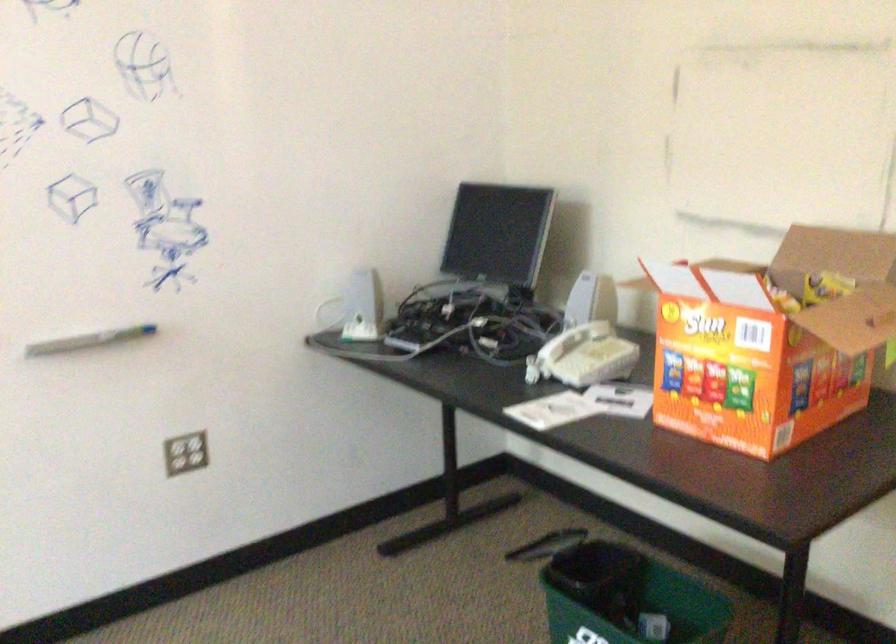
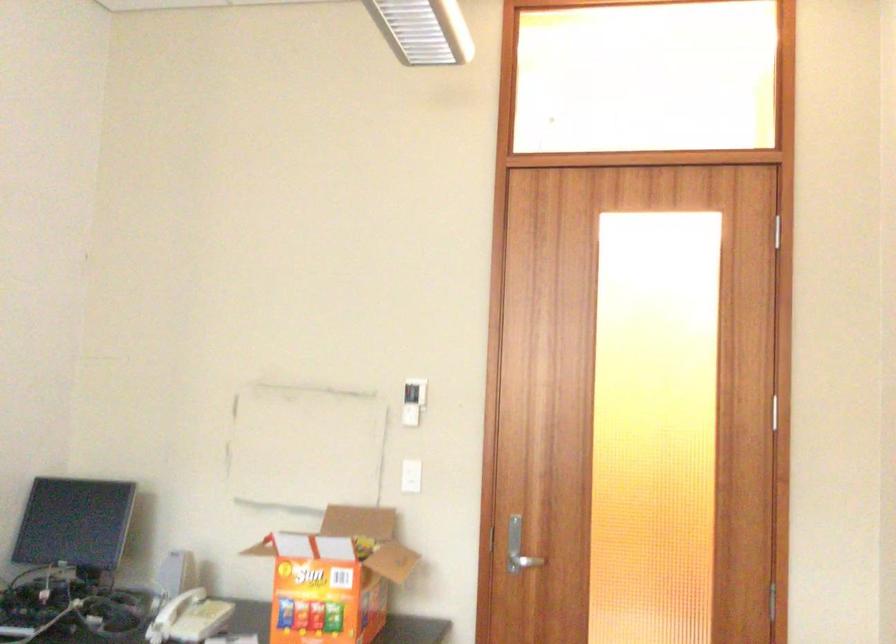
First-person continuous shooting, in which direction is the camera rotating?

The camera rotated toward right-up.